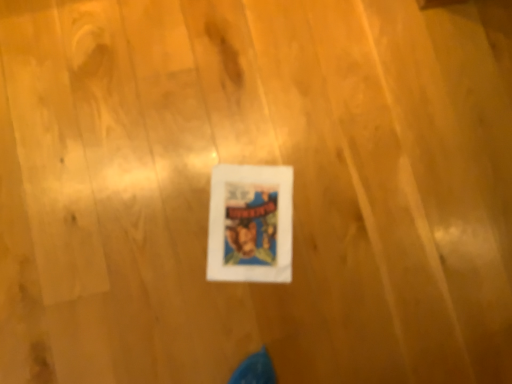
Image resolution: width=512 pixels, height=384 pixels. Identify the location of vacant space situated above white paper at center (from a real-world perspective). (245, 221).